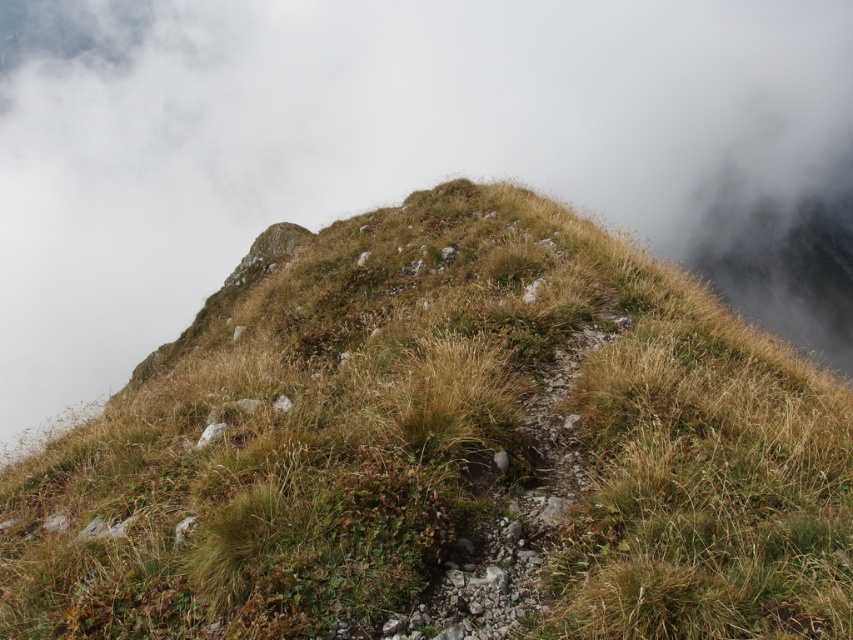
Can you confirm if green grassy at center is thinner than white fluffy cloud at upper center?

Yes.

Describe the element at coordinates (444, 449) in the screenshot. I see `green grassy at center` at that location.

Image resolution: width=853 pixels, height=640 pixels. Find the location of `green grassy at center`. green grassy at center is located at coordinates (444, 449).